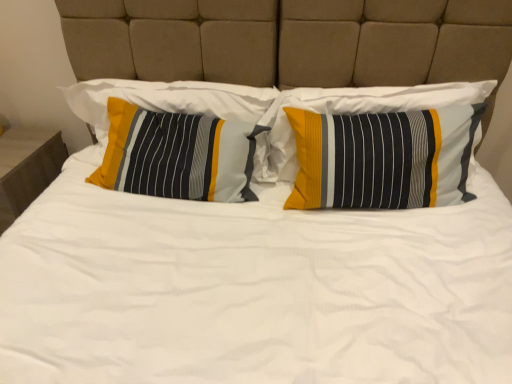
Question: From a real-world perspective, relative to matte wood nightstand at left, is textured striped pillow at left, marked as the 1th pillow in a left-to-right arrangement, vertically above or below?

Choices:
 (A) above
 (B) below

Answer: (A)

Question: Is textured striped pillow at left, marked as the 1th pillow in a left-to-right arrangement, spatially inside matte wood nightstand at left, or outside of it?

Choices:
 (A) inside
 (B) outside

Answer: (B)

Question: Which object is the farthest from the textured striped pillow at left, the 2th pillow positioned from the right?

Choices:
 (A) textured cotton pillow at center, the third pillow positioned from the left
 (B) matte wood nightstand at left
 (C) textured striped pillow at left, the 3th pillow from the right

Answer: (B)

Question: Which is farther from the textured striped pillow at left, which is the 2th pillow from left to right?

Choices:
 (A) textured striped pillow at left, the 3th pillow from the right
 (B) textured cotton pillow at center, the third pillow positioned from the left
 (C) matte wood nightstand at left

Answer: (C)